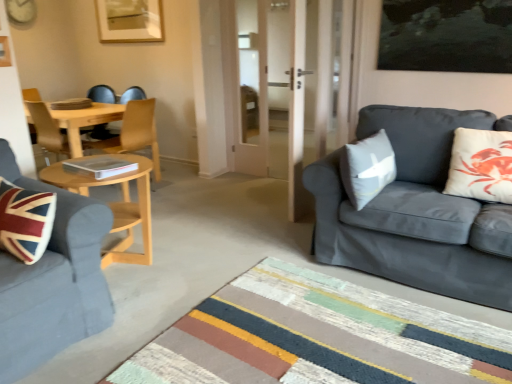
At what (x,y) coordinates should I click in order to perform the action: click on vacant space to the right of light wood coffee table at center left. Please return your answer as a coordinate pair (x, y). Image resolution: width=512 pixels, height=384 pixels. Looking at the image, I should click on (195, 272).